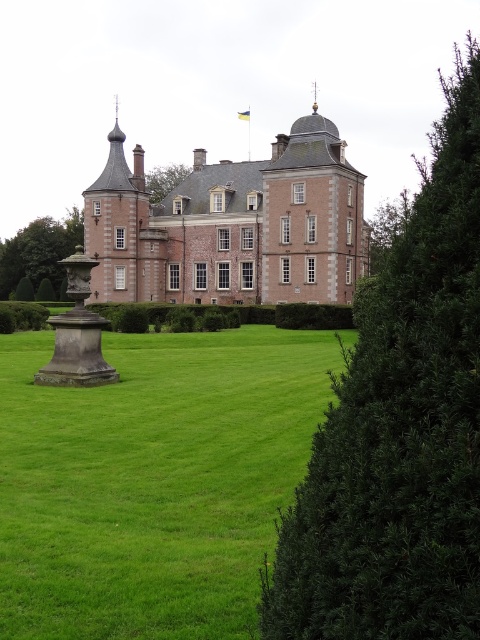
You are standing at the point marked as point (399,428). Looking around, you see a green leafy bush at right. Which direction should you walk to reach the stone statue or fountain on the left side of the image?

The green leafy bush at right is located to your right side. To reach the stone statue or fountain on the left side of the image, you should walk to your left.

You are standing on the green lawn and want to walk to the brick stone castle at center. Which direction should you walk to avoid the green leafy bush at right?

To walk to the brick stone castle at center while avoiding the green leafy bush at right, you should walk towards the left side of the castle. Since the green leafy bush at right is in front of the brick stone castle at center, moving to the left would allow you to bypass the bush and reach the castle.

You are standing on the lawn in front of the historic building. You see two points marked on the image. One is at point (x=268, y=504) and the other at point (x=288, y=186). Which point is closer to you?

Point (x=268, y=504) is in front of point (x=288, y=186), so it is closer to you.